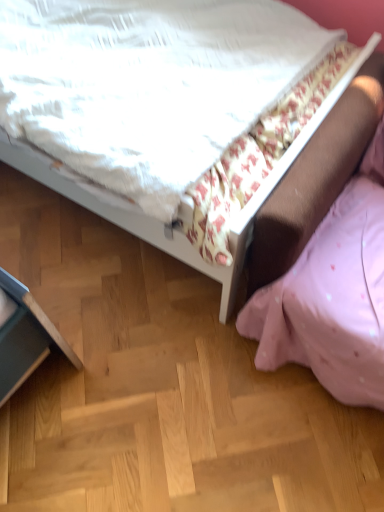
In the scene shown: Measure the distance between point (208, 62) and camera.

3.79 feet.

At what (x,y) coordinates should I click in order to perform the action: click on white fabric bed at upper center. Please return your answer as a coordinate pair (x, y). This screenshot has height=512, width=384. Looking at the image, I should click on (158, 106).

Image resolution: width=384 pixels, height=512 pixels. Describe the element at coordinates (158, 106) in the screenshot. I see `white fabric bed at upper center` at that location.

I want to click on white fabric bed at upper center, so click(158, 106).